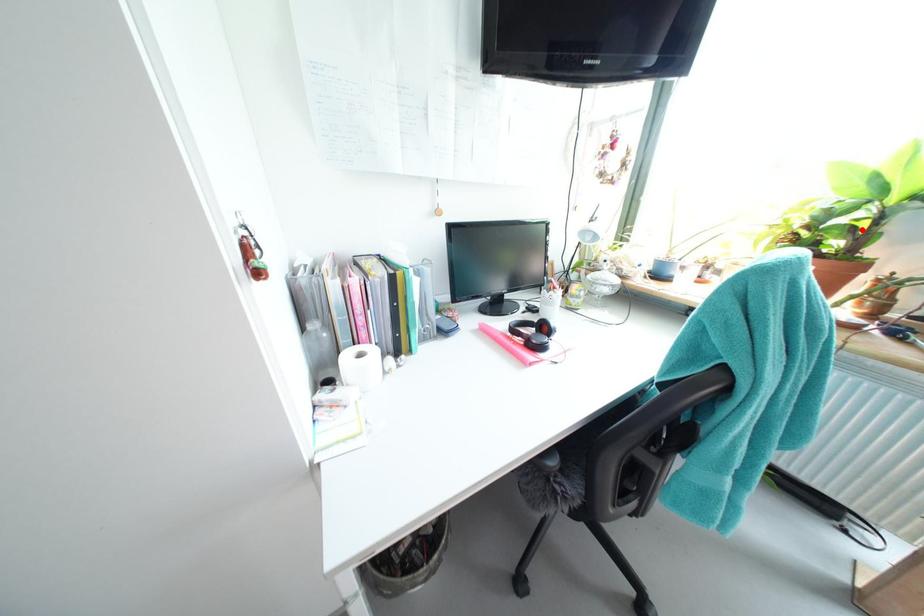
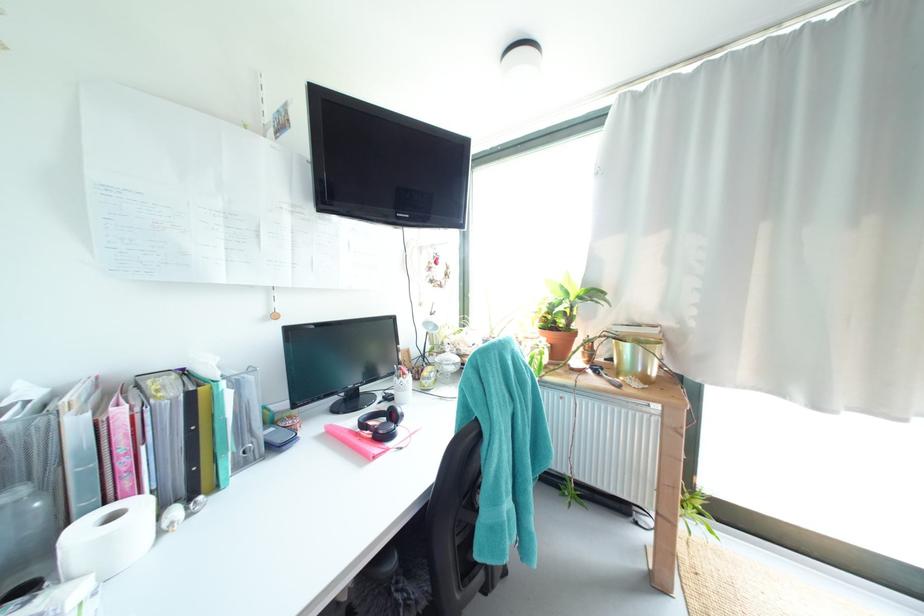
In the second image, find the point that corresponds to the highlighted location in the first image.

(573, 315)